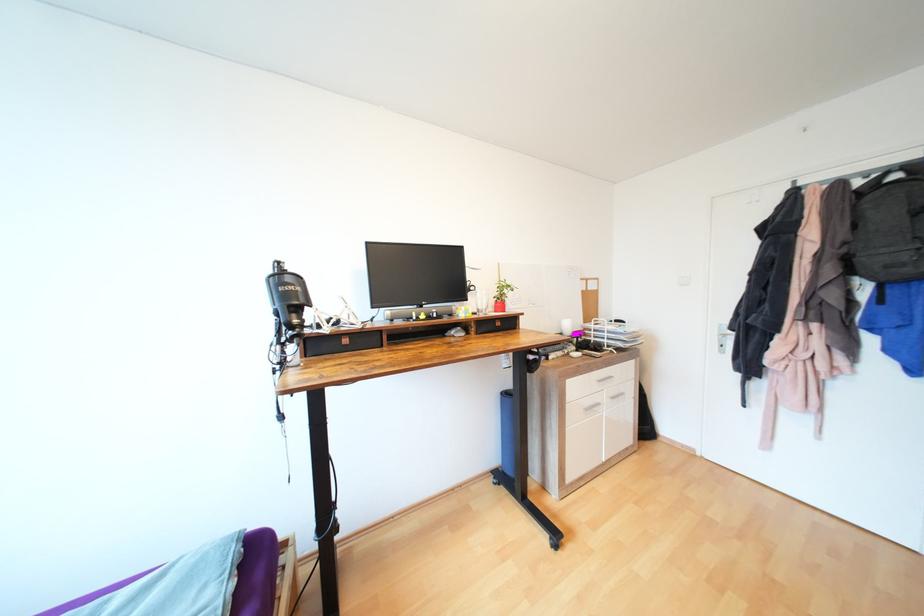
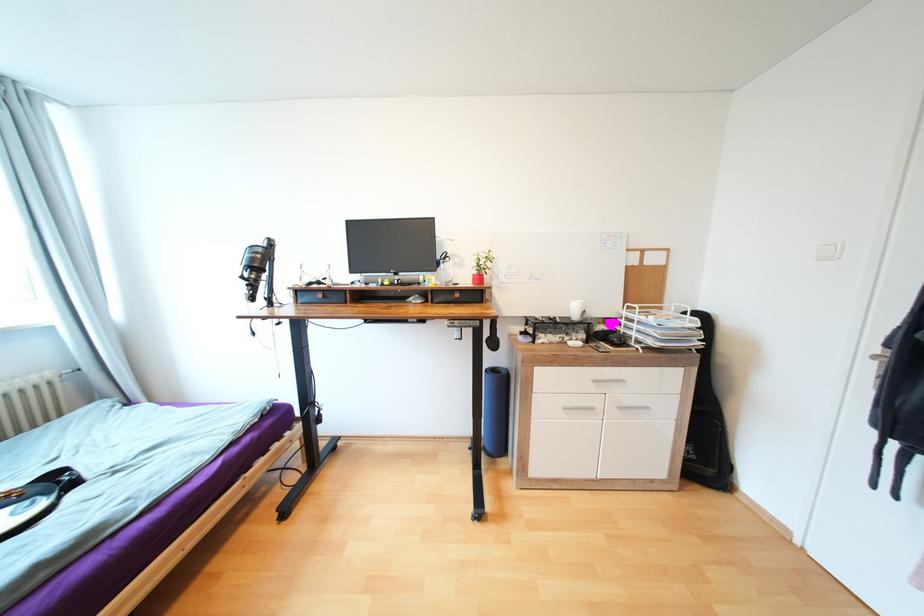
Question: The camera is either moving clockwise (left) or counter-clockwise (right) around the object. The first image is from the beginning of the video and the second image is from the end. Is the camera moving left or right when shooting the video?

Choices:
 (A) Left
 (B) Right

Answer: (B)